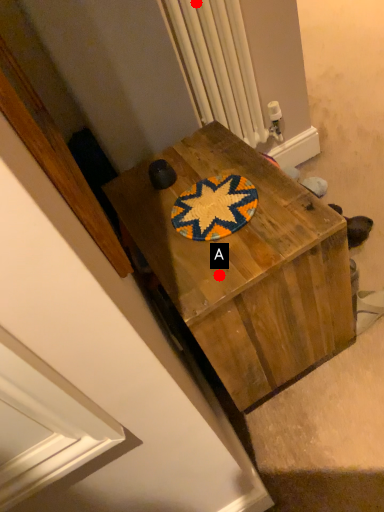
Question: Two points are circled on the image, labeled by A and B beside each circle. Which point is closer to the camera taking this photo?

Choices:
 (A) A is closer
 (B) B is closer

Answer: (A)